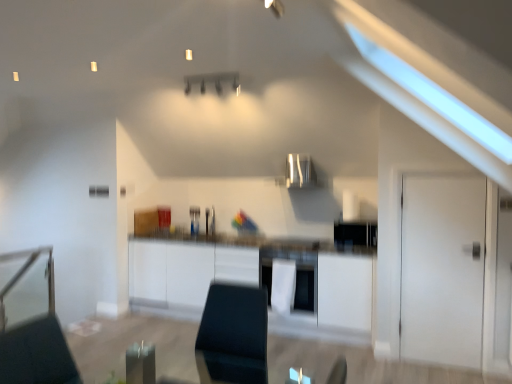
Locate an element on the screen. blank space situated above white matte door at right (from a real-world perspective) is located at coordinates (440, 170).